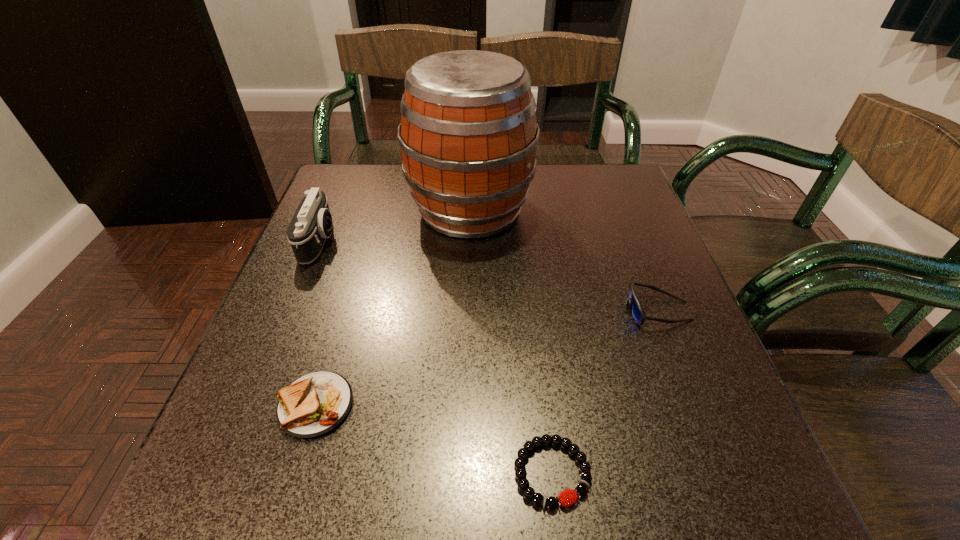
Where is `free space at the far edge of the desktop`? The image size is (960, 540). free space at the far edge of the desktop is located at coordinates (565, 175).

I want to click on vacant space at the near edge, so click(x=395, y=492).

The height and width of the screenshot is (540, 960). Find the location of `vacant space at the left edge of the desktop`. vacant space at the left edge of the desktop is located at coordinates (346, 230).

Where is `free spot at the right edge of the desktop`? The image size is (960, 540). free spot at the right edge of the desktop is located at coordinates (669, 394).

Identify the location of free space at the far left corner of the desktop. (345, 197).

The image size is (960, 540). I want to click on vacant space at the far right corner of the desktop, so pos(621,177).

At what (x,y) coordinates should I click in order to perform the action: click on free spot between the shortest object and the leftmost object. Please return your answer as a coordinate pair (x, y). Looking at the image, I should click on (436, 357).

I want to click on free area in between the third shortest object and the shortest object, so click(605, 392).

I want to click on vacant space that's between the camera and the rightmost object, so click(x=489, y=276).

At what (x,y) coordinates should I click in order to perform the action: click on vacant area that lies between the second object from left to right and the cider. Please return your answer as a coordinate pair (x, y). This screenshot has width=960, height=540. Looking at the image, I should click on (393, 308).